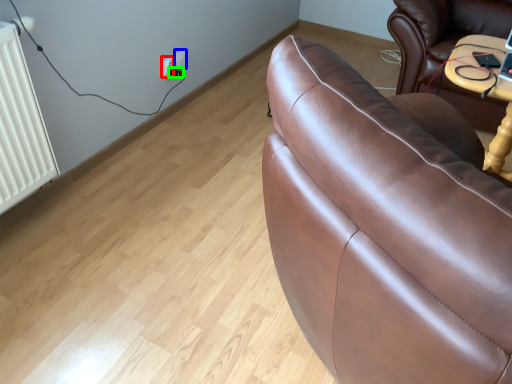
Question: Which object is positioned farthest from electric outlet (highlighted by a red box)? Select from electric outlet (highlighted by a blue box) and plug (highlighted by a green box).

Choices:
 (A) electric outlet
 (B) plug

Answer: (A)